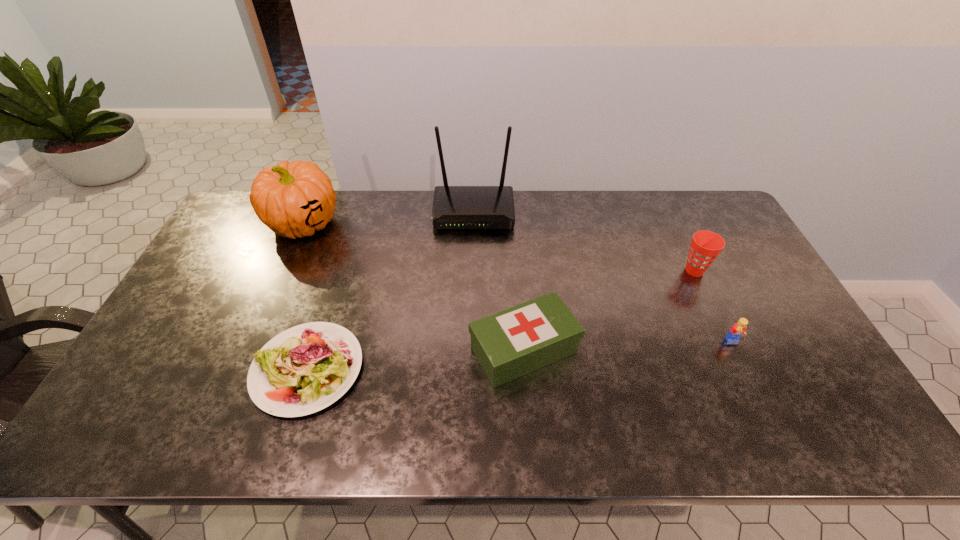
Identify the location of vacant area between the second shortest object and the router. (604, 277).

I want to click on free space that is in between the router and the fourth nearest object, so click(x=584, y=241).

The image size is (960, 540). Identify the location of unoccupied position between the first-aid kit and the second shortest object. (629, 346).

You are a GUI agent. You are given a task and a screenshot of the screen. Output one action in this format:
    pyautogui.click(x=<x>, y=<y>)
    Task: Click on the empty location between the Lego and the first-aid kit
    The width and height of the screenshot is (960, 540).
    Given the screenshot: What is the action you would take?
    pyautogui.click(x=629, y=346)

Identify the location of empty space that is in between the first-aid kit and the router. This screenshot has width=960, height=540. (499, 281).

Choose which object is the fourth nearest neighbor to the pumpkin. Please provide its 2D coordinates. Your answer should be formatted as a tuple, i.e. [(x, y)], where the tuple contains the x and y coordinates of a point satisfying the conditions above.

[(705, 246)]

This screenshot has height=540, width=960. In order to click on object that ranks as the closest to the pumpkin in this screenshot , I will do `click(304, 369)`.

Locate an element on the screen. vacant area that satisfies the following two spatial constraints: 1. on the back side of the third farthest object; 2. on the right side of the salad plate is located at coordinates coord(339,271).

The image size is (960, 540). In order to click on vacant area in the image that satisfies the following two spatial constraints: 1. on the surface of the first-aid kit; 2. on the left side of the pumpkin in this screenshot , I will do `click(248, 350)`.

You are a GUI agent. You are given a task and a screenshot of the screen. Output one action in this format:
    pyautogui.click(x=<x>, y=<y>)
    Task: Click on the free space in the image that satisfies the following two spatial constraints: 1. on the front-facing side of the cup; 2. on the right side of the router
    The width and height of the screenshot is (960, 540).
    Given the screenshot: What is the action you would take?
    pyautogui.click(x=472, y=271)